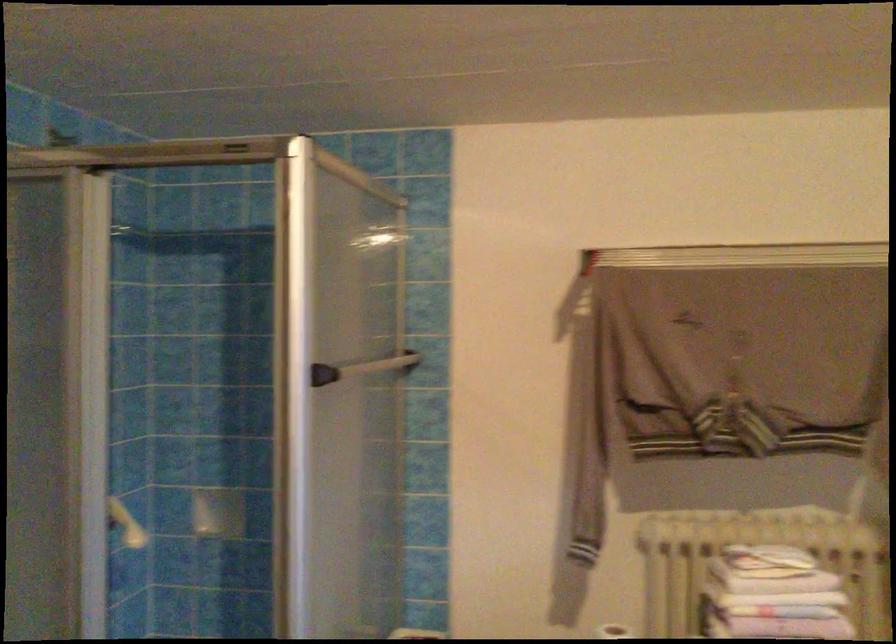
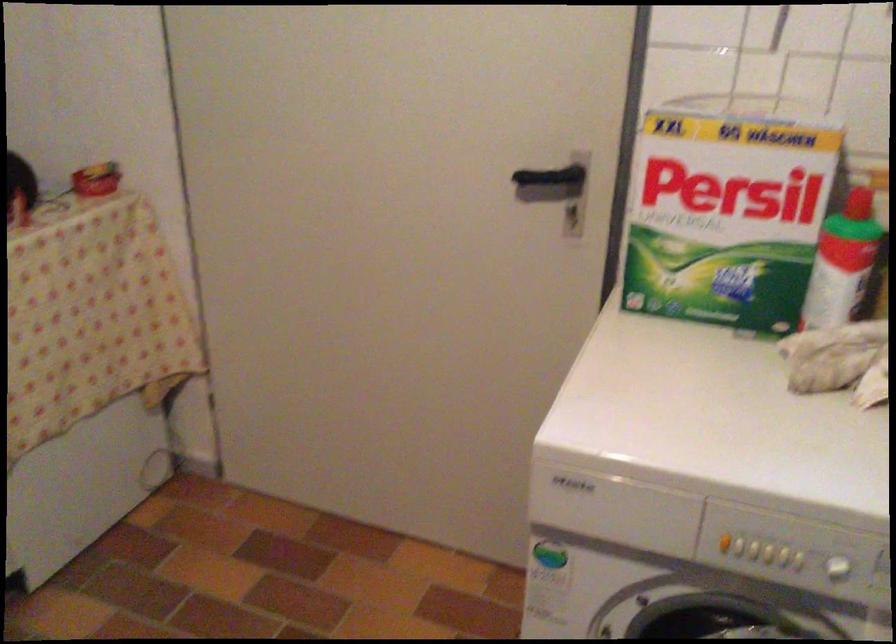
First-person continuous shooting, in which direction is the camera rotating?

The camera's rotation is toward right-down.